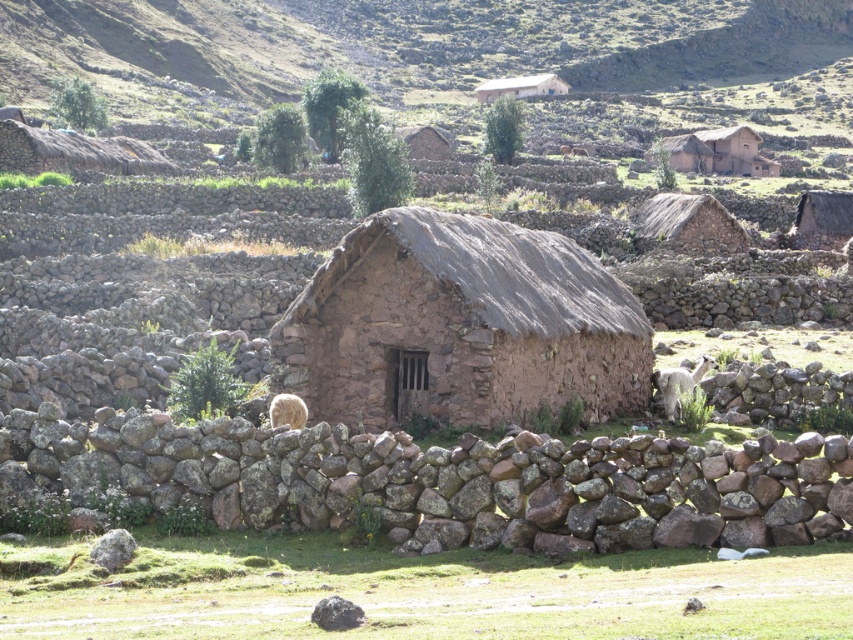
Based on the photo, you are standing in front of the rustic stone building and want to walk towards the green grass at lower center and the white woolen llama at right. Which one will you reach first?

You will reach the green grass at lower center first because it is closer to the viewer than the white woolen llama at right.

You are a traveler standing at the base of the mountain looking at the thatched straw hut at upper center and the fuzzy white sheep at lower left. Which object is higher up the mountain?

The thatched straw hut at upper center is taller than the fuzzy white sheep at lower left, so it is higher up the mountain.

You are a traveler carrying a backpack and need to set up camp for the night. You see the thatched straw hut at upper center and the fuzzy white sheep at lower left. Which object is wider, and can you use the wider one for shelter?

The thatched straw hut at upper center is wider than the fuzzy white sheep at lower left. You can use the thatched straw hut at upper center for shelter as it is wider and likely more suitable for providing cover.